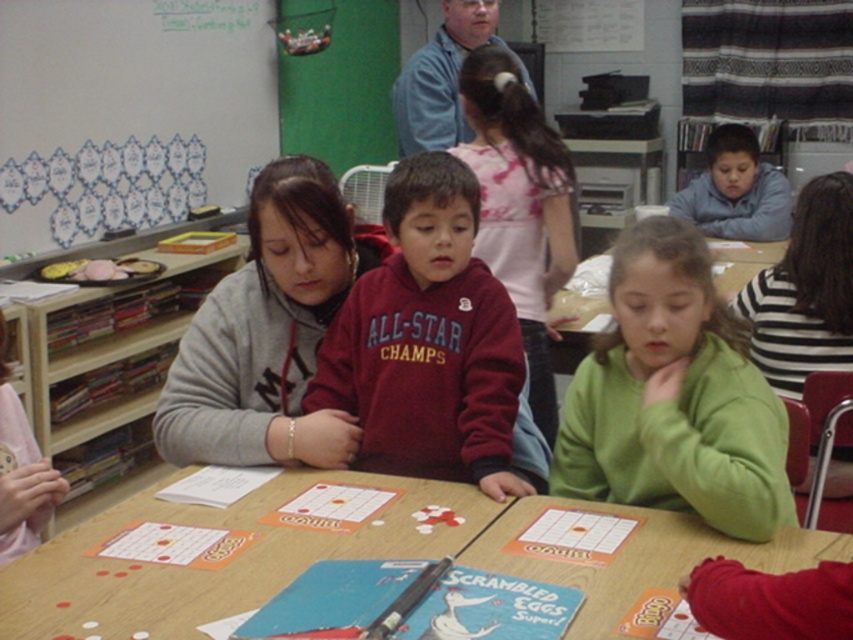
Is wooden table at center in front of blue fleece hoodie at upper right?

Yes, it is.

Which is in front, point (601, 506) or point (775, 195)?

Point (601, 506) is more forward.

Locate an element on the screen. wooden table at center is located at coordinates (352, 557).

Which is more to the left, wooden table at center or blue cotton shirt at upper center?

Positioned to the left is wooden table at center.

Is point (554, 570) positioned after point (480, 4)?

No, (554, 570) is in front of (480, 4).

Who is more forward, (521, 513) or (496, 38)?

Point (521, 513)

The height and width of the screenshot is (640, 853). What are the coordinates of `wooden table at center` in the screenshot? It's located at (352, 557).

Is green matte sweatshirt at center taller than blue fleece hoodie at upper right?

Incorrect, green matte sweatshirt at center's height is not larger of blue fleece hoodie at upper right's.

Does point (669, 339) come farther from viewer compared to point (741, 157)?

That is False.

Is point (653, 244) positioned after point (729, 141)?

No.

Identify the location of green matte sweatshirt at center. (674, 397).